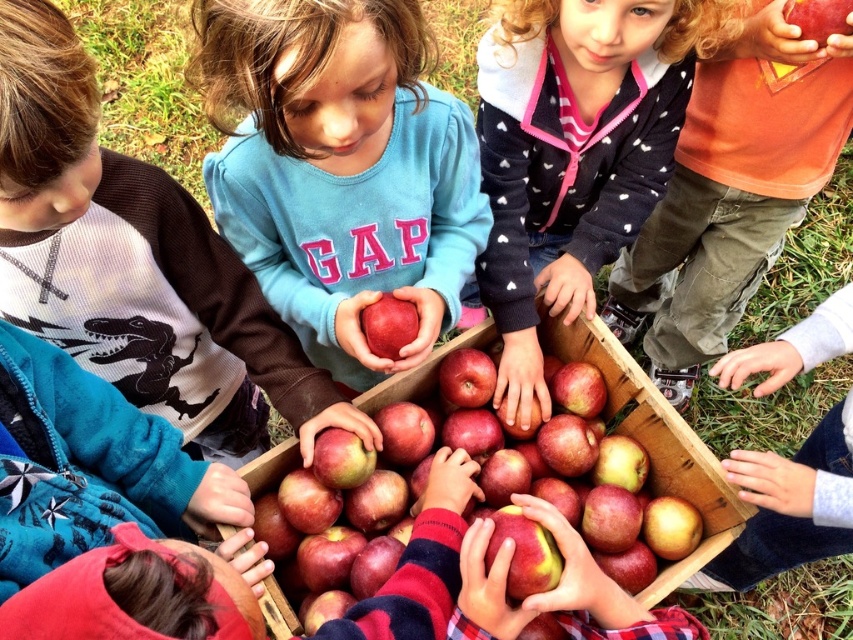
Between matte blue sweater at center and matte red apple at center, which one is positioned lower?

matte red apple at center is lower down.

Between matte blue sweater at center and matte red apple at center, which one appears on the right side from the viewer's perspective?

From the viewer's perspective, matte red apple at center appears more on the right side.

In order to click on matte blue sweater at center in this screenshot , I will do `click(340, 168)`.

In order to click on matte blue sweater at center in this screenshot , I will do `click(340, 168)`.

Does matte blue sweater at center have a greater height compared to matte brown sweater at lower left?

Incorrect, matte blue sweater at center's height is not larger of matte brown sweater at lower left's.

Can you confirm if matte blue sweater at center is positioned below matte brown sweater at lower left?

Actually, matte blue sweater at center is above matte brown sweater at lower left.

Does point (352, 292) come behind point (169, 241)?

Yes, it is.

Find the location of a particular element. The height and width of the screenshot is (640, 853). matte blue sweater at center is located at coordinates (340, 168).

Is the position of dark blue sweater at center less distant than that of shiny red apple at center?

No, dark blue sweater at center is further to the viewer.

Does dark blue sweater at center have a greater height compared to shiny red apple at center?

Yes, dark blue sweater at center is taller than shiny red apple at center.

Locate an element on the screen. This screenshot has width=853, height=640. dark blue sweater at center is located at coordinates (573, 154).

Locate an element on the screen. The image size is (853, 640). dark blue sweater at center is located at coordinates (573, 154).